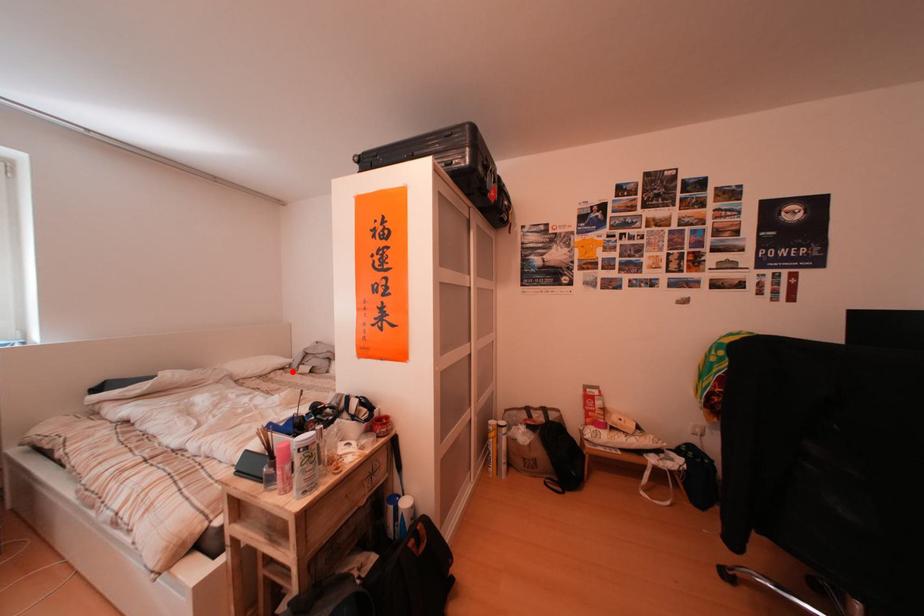
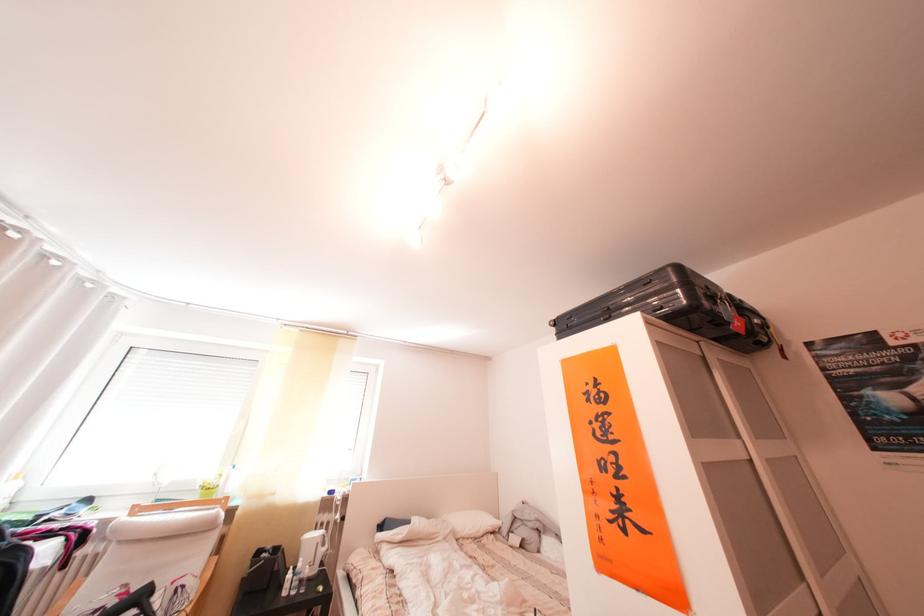
Where in the second image is the point corresponding to the highlighted location from the first image?

(504, 535)